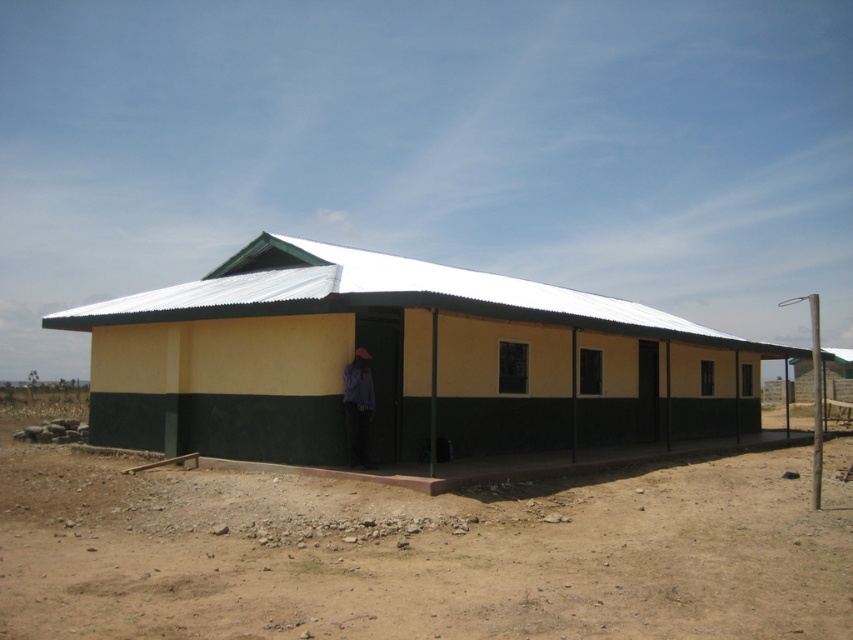
Who is more distant from viewer, (294, 518) or (595, 307)?

Point (595, 307)

Does brown sandy dirt at lower center come behind yellow matte building at center?

No, it is not.

Does point (734, 522) come closer to viewer compared to point (141, 339)?

That is True.

This screenshot has width=853, height=640. I want to click on brown sandy dirt at lower center, so click(x=422, y=552).